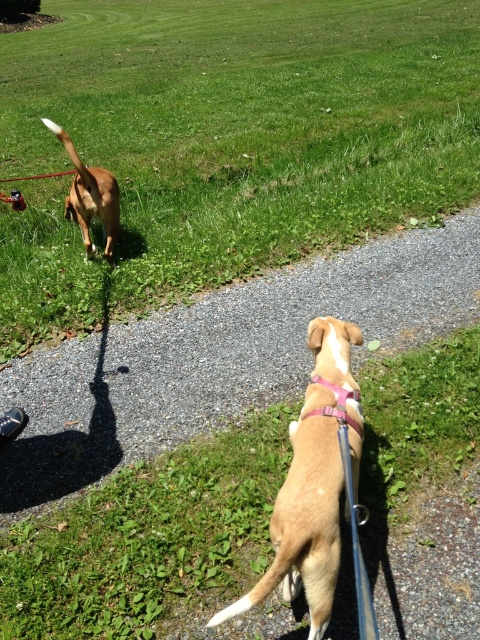
Question: Among these points, which one is nearest to the camera?

Choices:
 (A) (332, 513)
 (B) (324, 416)
 (C) (254, 280)
 (D) (113, 188)

Answer: (A)

Question: Does gravel path at center have a lesser width compared to light brown fur at center?

Choices:
 (A) no
 (B) yes

Answer: (A)

Question: Which point is farther to the camera?

Choices:
 (A) gravel path at center
 (B) green grass at upper center
 (C) brown fur dog at upper left
 (D) pink fabric neckband at center

Answer: (B)

Question: From the image, what is the correct spatial relationship of light brown fur at center in relation to pink fabric neckband at center?

Choices:
 (A) left
 (B) right

Answer: (A)

Question: Which of these objects is positioned farthest from the green grass at upper center?

Choices:
 (A) light brown fur at center
 (B) gravel path at center

Answer: (A)

Question: Does gravel path at center have a lesser width compared to brown fur dog at upper left?

Choices:
 (A) no
 (B) yes

Answer: (A)